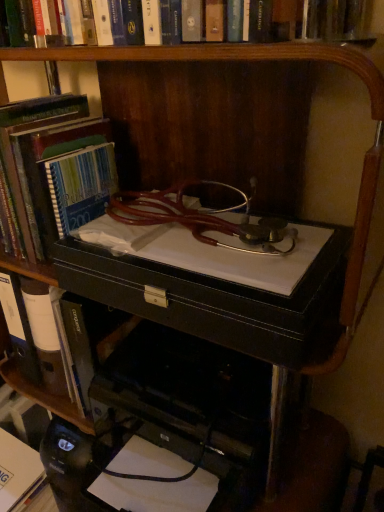
Question: From a real-world perspective, does black leather computer desk at center sit lower than black leather book at center, marked as the 2th book in a bottom-to-top arrangement?

Choices:
 (A) no
 (B) yes

Answer: (B)

Question: Is black leather computer desk at center positioned with its back to black leather book at center, arranged as the 2th book when viewed from the top?

Choices:
 (A) yes
 (B) no

Answer: (B)

Question: Is black leather book at center, marked as the 2th book in a bottom-to-top arrangement, located within black leather computer desk at center?

Choices:
 (A) yes
 (B) no

Answer: (B)

Question: Considering the relative sizes of black leather computer desk at center and black leather book at center, arranged as the 2th book when viewed from the top, in the image provided, is black leather computer desk at center shorter than black leather book at center, arranged as the 2th book when viewed from the top,?

Choices:
 (A) no
 (B) yes

Answer: (B)

Question: Is black leather computer desk at center at the right side of black leather book at center, marked as the 2th book in a bottom-to-top arrangement?

Choices:
 (A) yes
 (B) no

Answer: (A)

Question: Is white paper at lower left, which ranks as the first book in bottom-to-top order, inside the boundaries of black leather drawer at center, or outside?

Choices:
 (A) inside
 (B) outside

Answer: (B)

Question: In the image, is white paper at lower left, which ranks as the first book in bottom-to-top order, on the left side or the right side of black leather drawer at center?

Choices:
 (A) left
 (B) right

Answer: (A)

Question: Considering the positions of white paper at lower left, which ranks as the first book in bottom-to-top order, and black leather drawer at center in the image, is white paper at lower left, which ranks as the first book in bottom-to-top order, bigger or smaller than black leather drawer at center?

Choices:
 (A) small
 (B) big

Answer: (A)

Question: Considering the positions of point (11, 415) and point (230, 327), is point (11, 415) closer or farther from the camera than point (230, 327)?

Choices:
 (A) farther
 (B) closer

Answer: (A)

Question: In terms of size, does black leather book at center, arranged as the 2th book when viewed from the top, appear bigger or smaller than black leather computer desk at center?

Choices:
 (A) big
 (B) small

Answer: (B)

Question: Considering the positions of black leather book at center, arranged as the 2th book when viewed from the top, and black leather computer desk at center in the image, is black leather book at center, arranged as the 2th book when viewed from the top, taller or shorter than black leather computer desk at center?

Choices:
 (A) short
 (B) tall

Answer: (B)

Question: From the image's perspective, is black leather book at center, marked as the 2th book in a bottom-to-top arrangement, positioned above or below black leather computer desk at center?

Choices:
 (A) above
 (B) below

Answer: (A)

Question: Is black leather book at center, marked as the 2th book in a bottom-to-top arrangement, wider or thinner than black leather computer desk at center?

Choices:
 (A) wide
 (B) thin

Answer: (B)

Question: Is blue striped notebook at center, the 1th book in the top-to-bottom sequence, inside the boundaries of black leather computer desk at center, or outside?

Choices:
 (A) inside
 (B) outside

Answer: (B)

Question: Visually, is blue striped notebook at center, the 1th book in the top-to-bottom sequence, positioned to the left or to the right of black leather computer desk at center?

Choices:
 (A) left
 (B) right

Answer: (A)